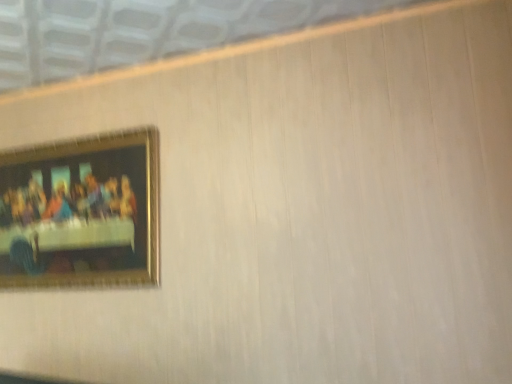
You are a GUI agent. You are given a task and a screenshot of the screen. Output one action in this format:
    pyautogui.click(x=<x>, y=<y>)
    Task: Click on the gold-framed painting at upper left
    Image resolution: width=512 pixels, height=384 pixels.
    Given the screenshot: What is the action you would take?
    pyautogui.click(x=81, y=212)

Describe the element at coordinates (81, 212) in the screenshot. I see `gold-framed painting at upper left` at that location.

The image size is (512, 384). I want to click on gold-framed painting at upper left, so click(81, 212).